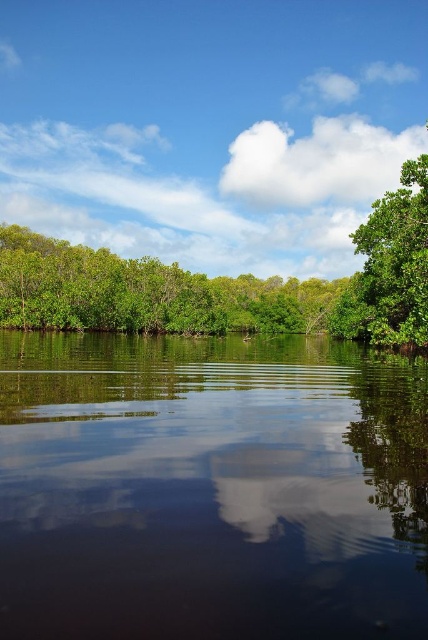
Question: Which of these objects is positioned closest to the green leafy trees at left?

Choices:
 (A) dark reflective water at center
 (B) green matte tree at right

Answer: (B)

Question: Is dark reflective water at center smaller than green leafy trees at left?

Choices:
 (A) no
 (B) yes

Answer: (B)

Question: Can you confirm if dark reflective water at center is thinner than green leafy trees at left?

Choices:
 (A) yes
 (B) no

Answer: (A)

Question: Which of the following is the farthest from the observer?

Choices:
 (A) green leafy trees at left
 (B) green matte tree at right
 (C) dark reflective water at center

Answer: (A)

Question: Which point is farther from the camera taking this photo?

Choices:
 (A) (392, 284)
 (B) (26, 275)

Answer: (B)

Question: Does green leafy trees at left appear under green matte tree at right?

Choices:
 (A) no
 (B) yes

Answer: (A)